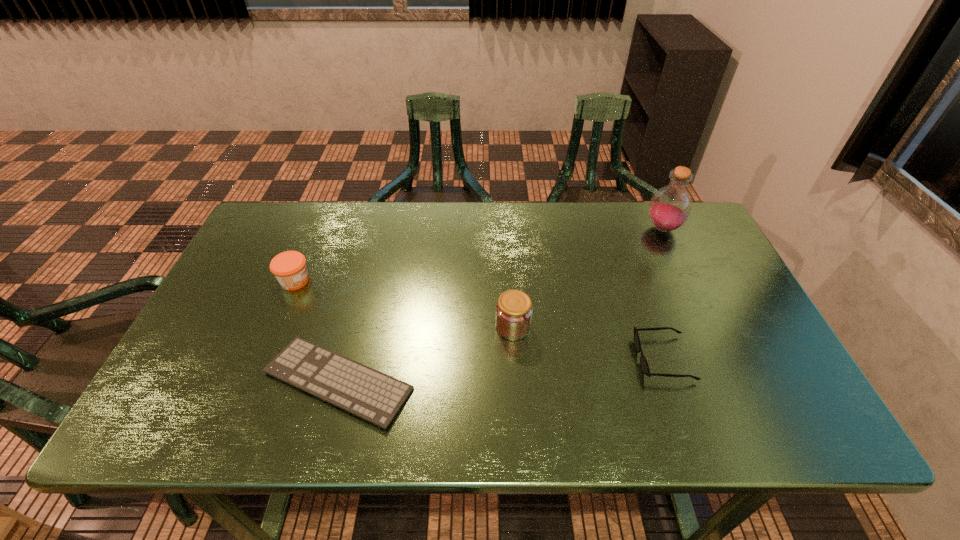
Locate an element on the screen. vacant area situated 0.050m on the back of the third object from right to left is located at coordinates (511, 299).

Where is `free space located 0.150m on the front label of the farther jam`? free space located 0.150m on the front label of the farther jam is located at coordinates (366, 281).

Locate an element on the screen. This screenshot has height=540, width=960. vacant space situated 0.170m on the front-facing side of the second shortest object is located at coordinates (566, 358).

You are a GUI agent. You are given a task and a screenshot of the screen. Output one action in this format:
    pyautogui.click(x=<x>, y=<y>)
    Task: Click on the vacant space located on the front-facing side of the second shortest object
    The width and height of the screenshot is (960, 540).
    Given the screenshot: What is the action you would take?
    pyautogui.click(x=528, y=358)

At what (x,y) coordinates should I click in order to perform the action: click on blank space located 0.180m on the front-facing side of the second shortest object. Please return your answer as a coordinate pair (x, y). This screenshot has width=960, height=540. Looking at the image, I should click on (563, 358).

Locate an element on the screen. The height and width of the screenshot is (540, 960). free space located on the back of the computer keyboard is located at coordinates (372, 254).

Image resolution: width=960 pixels, height=540 pixels. In order to click on object situated at the far edge in this screenshot , I will do `click(670, 207)`.

Find the location of `object that is positioned at the near edge`. object that is positioned at the near edge is located at coordinates (376, 397).

At what (x,y) coordinates should I click in order to perform the action: click on object situated at the left edge. Please return your answer as a coordinate pair (x, y). Looking at the image, I should click on (289, 267).

Image resolution: width=960 pixels, height=540 pixels. I want to click on object that is at the right edge, so click(x=670, y=207).